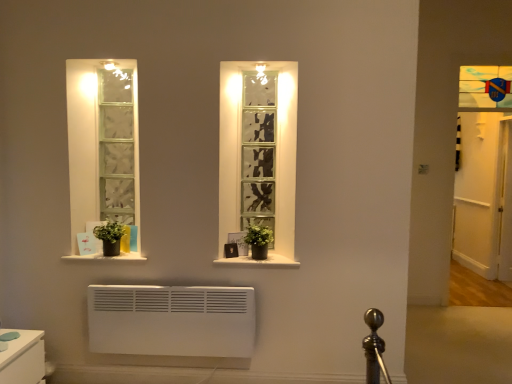
Question: Is the depth of black matte window sill at center, the 1th window sill when ordered from right to left, greater than that of white wooden door at right?

Choices:
 (A) yes
 (B) no

Answer: (B)

Question: Does black matte window sill at center, the 1th window sill when ordered from right to left, have a greater width compared to white wooden door at right?

Choices:
 (A) yes
 (B) no

Answer: (A)

Question: Can you confirm if black matte window sill at center, arranged as the second window sill when viewed from the left, is thinner than white wooden door at right?

Choices:
 (A) yes
 (B) no

Answer: (B)

Question: Is black matte window sill at center, the 1th window sill when ordered from right to left, looking in the opposite direction of white wooden door at right?

Choices:
 (A) yes
 (B) no

Answer: (B)

Question: Does black matte window sill at center, arranged as the second window sill when viewed from the left, appear on the right side of white wooden door at right?

Choices:
 (A) no
 (B) yes

Answer: (A)

Question: In the image, is white matte window sill at lower left, which is the first window sill in left-to-right order, on the left side or the right side of white wooden door at right?

Choices:
 (A) left
 (B) right

Answer: (A)

Question: Is white matte window sill at lower left, which ranks as the 2th window sill in right-to-left order, inside the boundaries of white wooden door at right, or outside?

Choices:
 (A) inside
 (B) outside

Answer: (B)

Question: Relative to white wooden door at right, is white matte window sill at lower left, which is the first window sill in left-to-right order, in front or behind?

Choices:
 (A) front
 (B) behind

Answer: (A)

Question: Based on their sizes in the image, would you say white matte window sill at lower left, which is the first window sill in left-to-right order, is bigger or smaller than white wooden door at right?

Choices:
 (A) big
 (B) small

Answer: (B)

Question: From their relative heights in the image, would you say white wooden door at right is taller or shorter than white matte window sill at lower left, which ranks as the 2th window sill in right-to-left order?

Choices:
 (A) tall
 (B) short

Answer: (A)

Question: Considering the positions of white wooden door at right and white matte window sill at lower left, which is the first window sill in left-to-right order, in the image, is white wooden door at right wider or thinner than white matte window sill at lower left, which is the first window sill in left-to-right order,?

Choices:
 (A) wide
 (B) thin

Answer: (B)

Question: In the image, is white wooden door at right on the left side or the right side of white matte window sill at lower left, which ranks as the 2th window sill in right-to-left order?

Choices:
 (A) right
 (B) left

Answer: (A)

Question: From the image's perspective, relative to white matte window sill at lower left, which ranks as the 2th window sill in right-to-left order, is white wooden door at right above or below?

Choices:
 (A) below
 (B) above

Answer: (B)

Question: In the image, is green matte plant at center, marked as the 2th plant in a left-to-right arrangement, on the left side or the right side of white matte window sill at lower left, which ranks as the 2th window sill in right-to-left order?

Choices:
 (A) right
 (B) left

Answer: (A)

Question: From a real-world perspective, is green matte plant at center, marked as the 2th plant in a left-to-right arrangement, positioned above or below white matte window sill at lower left, which ranks as the 2th window sill in right-to-left order?

Choices:
 (A) above
 (B) below

Answer: (A)